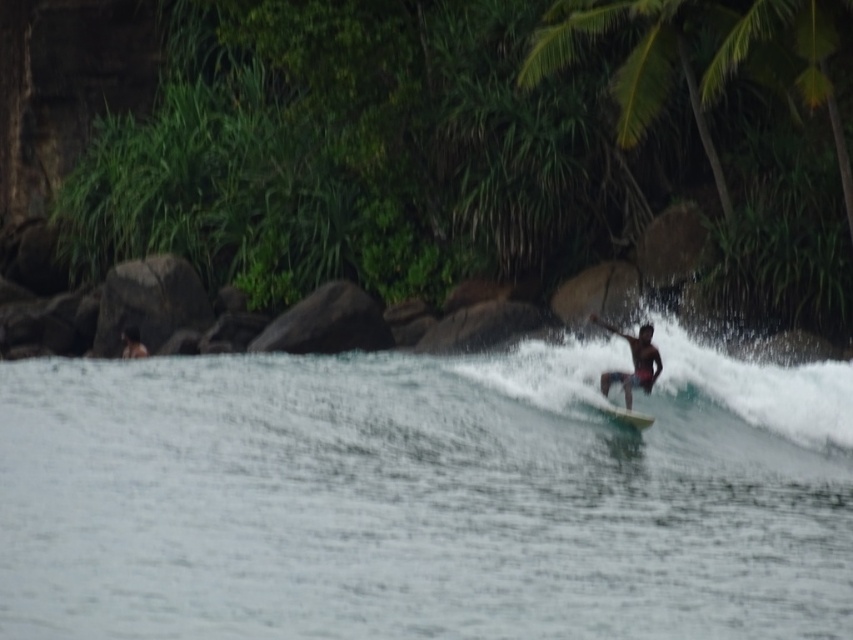
You are a drone operator trying to capture a photo of the surfer in the tropical coastal scene. The drone is currently hovering at point (369, 150), which is labeled as green leafy vegetation at center. To get a clear shot of the surfer, should you move the drone to the left or right?

The point (369, 150) corresponds to green leafy vegetation at center. Since the surfer is positioned slightly to the right side of the frame, you should move the drone to the right to capture a clear shot of the surfer.

You are standing at the camera position and want to take a photo of the dark brown skin surfer at center. The camera has a maximum focus range of 50 meters. Will the camera be able to focus on the surfer?

The dark brown skin surfer at center and camera are 51.73 meters apart, which exceeds the camera maximum focus range of 50 meters. The camera will not be able to focus on the surfer.

You are standing at the point marked by the coordinates point (633, 362) in the image. Looking towards the direction of the waves, what do you see in front of you?

dark brown skin surfer at center is represented by point (633, 362). Looking towards the direction of the waves, you would see the body of water with gentle waves rolling towards the shore, reflecting the overcast sky above.